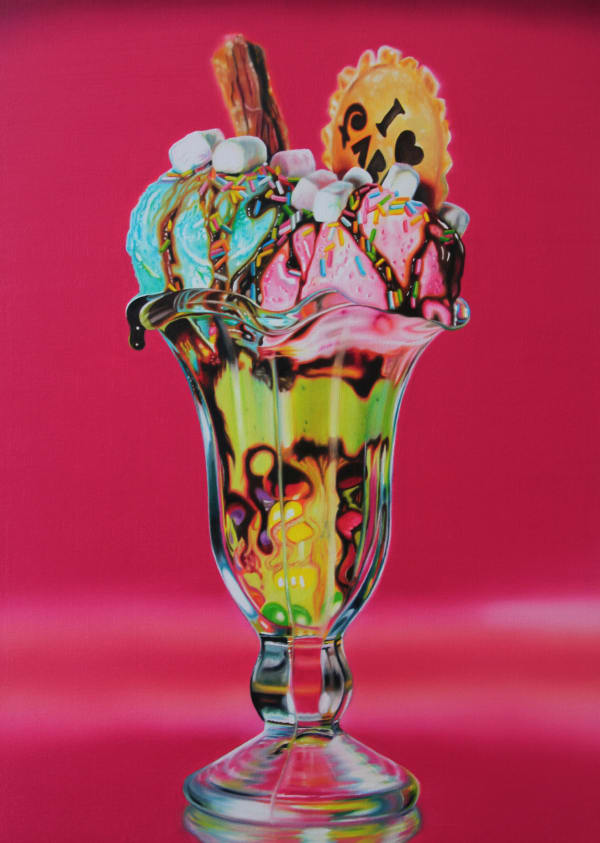
The width and height of the screenshot is (600, 843). I want to click on glass, so click(262, 459), click(371, 803).